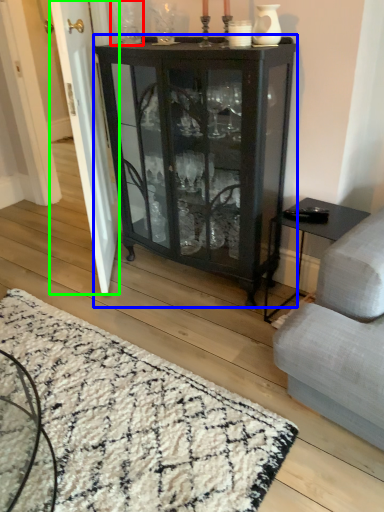
Question: Which object is the closest to the glass vase (highlighted by a red box)? Choose among these: cupboard (highlighted by a blue box) or screen door (highlighted by a green box).

Choices:
 (A) cupboard
 (B) screen door

Answer: (B)